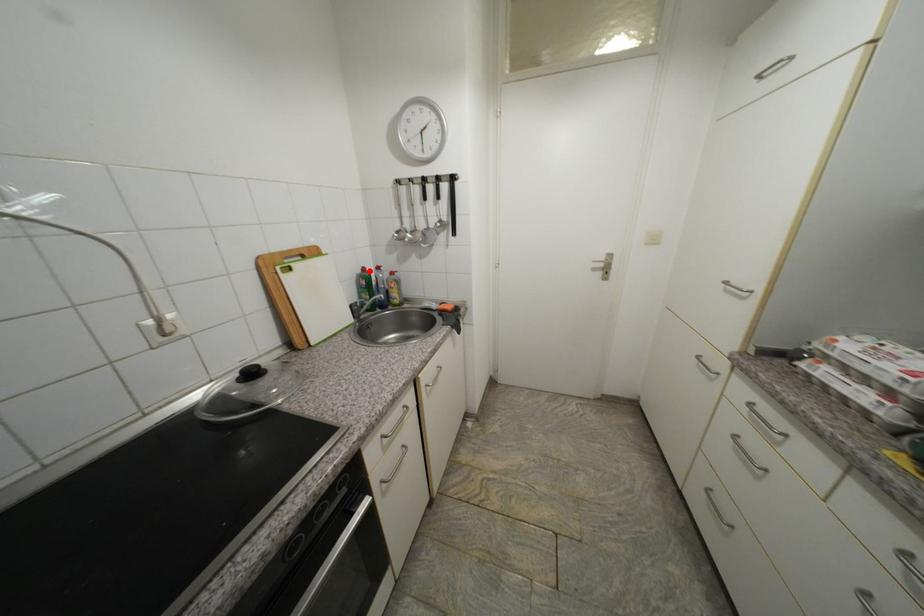
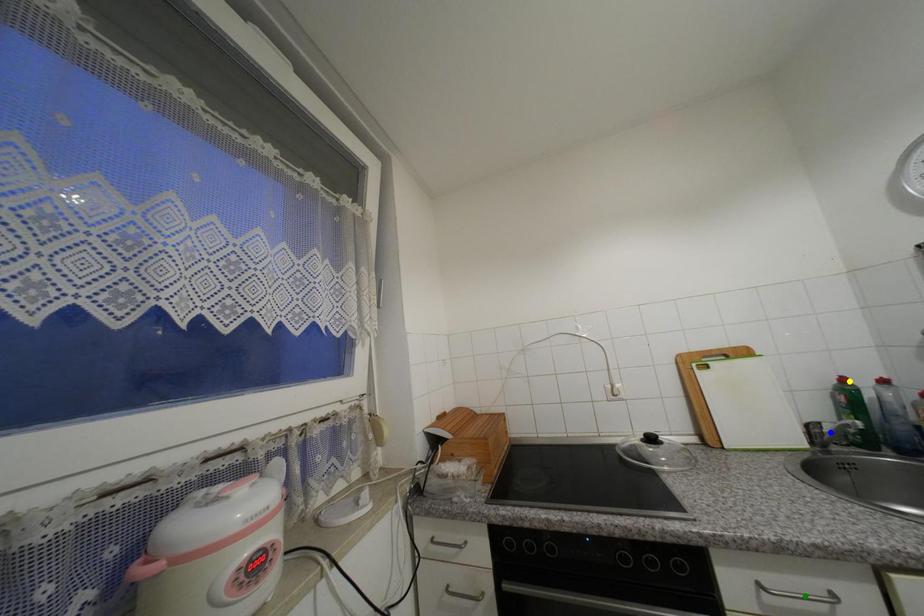
Question: I am providing you with two images of the same scene from different viewpoints. A red point is marked on the first image. You are given multiple points on the second image. Which point in image 2 represents the same 3d spot as the red point in image 1?

Choices:
 (A) blue point
 (B) green point
 (C) yellow point

Answer: (C)